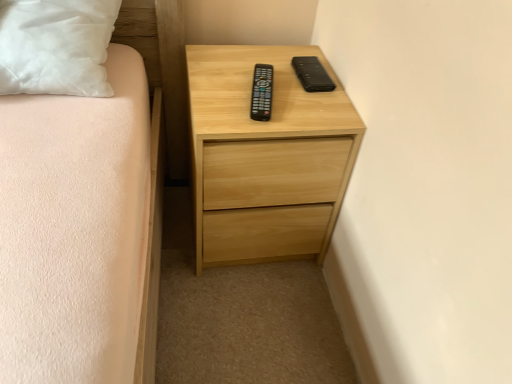
The image size is (512, 384). Find the location of `free region on the left part of black plastic remote at center`. free region on the left part of black plastic remote at center is located at coordinates (218, 96).